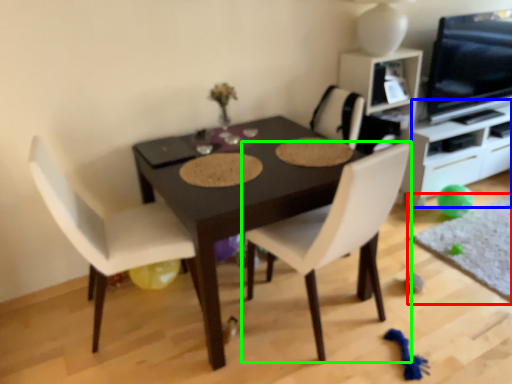
Question: Estimate the real-world distances between objects in this image. Which object is farther from place mat (highlighted by a red box), entertainment center (highlighted by a blue box) or chair (highlighted by a green box)?

Choices:
 (A) entertainment center
 (B) chair

Answer: (B)